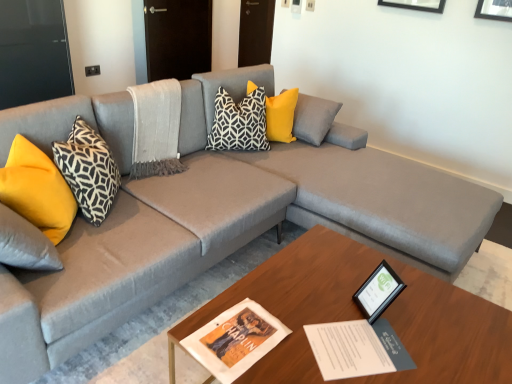
Locate an element on the screen. This screenshot has height=384, width=512. blank space situated above wooden coffee table at center (from a real-world perspective) is located at coordinates (364, 327).